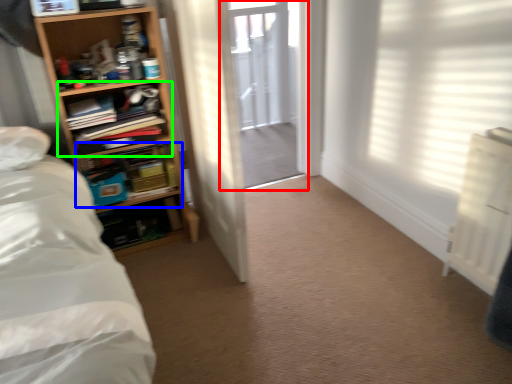
Question: Considering the real-world distances, which object is farthest from screen door (highlighted by a red box)? shelf (highlighted by a blue box) or shelf (highlighted by a green box)?

Choices:
 (A) shelf
 (B) shelf

Answer: (B)